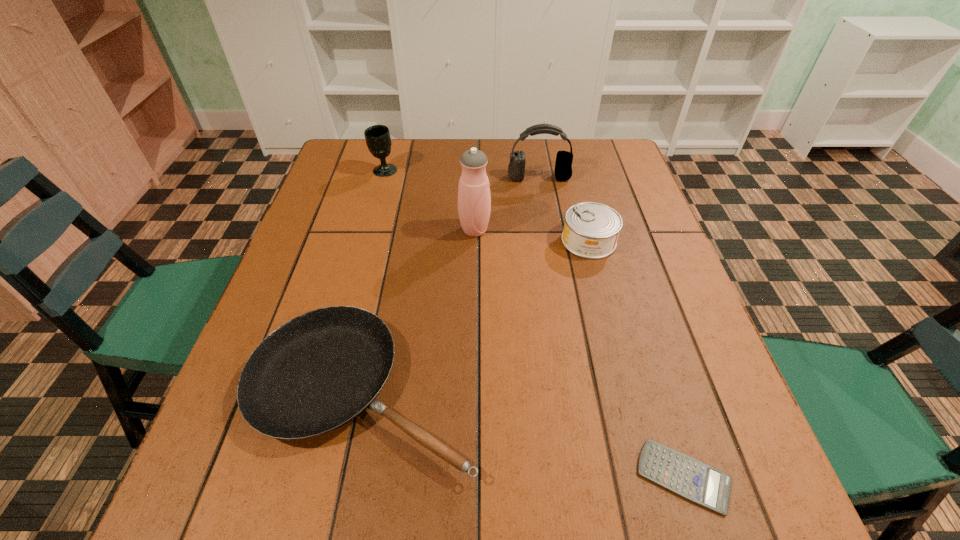
Where is `free space located on the back of the fifth tallest object`? Image resolution: width=960 pixels, height=540 pixels. free space located on the back of the fifth tallest object is located at coordinates (392, 248).

I want to click on free location located 0.340m on the left of the shortest object, so click(x=424, y=476).

You are a GUI agent. You are given a task and a screenshot of the screen. Output one action in this format:
    pyautogui.click(x=<x>, y=<y>)
    Task: Click on the headset that is at the far edge
    The width and height of the screenshot is (960, 540).
    Given the screenshot: What is the action you would take?
    pyautogui.click(x=563, y=166)

Image resolution: width=960 pixels, height=540 pixels. What are the coordinates of `chalice that is at the far edge` in the screenshot? It's located at (378, 139).

Where is `frying pan situated at the near edge`? The width and height of the screenshot is (960, 540). frying pan situated at the near edge is located at coordinates (317, 372).

Identify the location of calculator that is at the near edge. (692, 479).

Find the location of a particular element. The width and height of the screenshot is (960, 540). chalice located in the left edge section of the desktop is located at coordinates (378, 139).

Where is `frying pan that is at the left edge`? This screenshot has width=960, height=540. frying pan that is at the left edge is located at coordinates (317, 372).

Identify the location of can that is at the right edge. (591, 230).

I want to click on calculator present at the right edge, so click(692, 479).